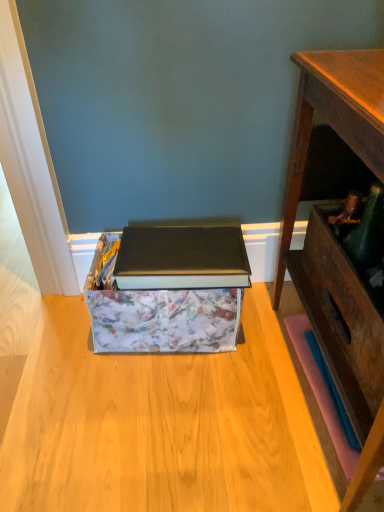
Question: Looking at the image, does floral-patterned cardboard box at center seem bigger or smaller compared to wooden desk at right?

Choices:
 (A) big
 (B) small

Answer: (B)

Question: In terms of width, does floral-patterned cardboard box at center look wider or thinner when compared to wooden desk at right?

Choices:
 (A) wide
 (B) thin

Answer: (B)

Question: In the image, is floral-patterned cardboard box at center positioned in front of or behind wooden desk at right?

Choices:
 (A) behind
 (B) front

Answer: (A)

Question: Considering the positions of wooden desk at right and floral-patterned cardboard box at center in the image, is wooden desk at right wider or thinner than floral-patterned cardboard box at center?

Choices:
 (A) thin
 (B) wide

Answer: (B)

Question: Based on their sizes in the image, would you say wooden desk at right is bigger or smaller than floral-patterned cardboard box at center?

Choices:
 (A) small
 (B) big

Answer: (B)

Question: From a real-world perspective, is wooden desk at right above or below floral-patterned cardboard box at center?

Choices:
 (A) below
 (B) above

Answer: (B)

Question: Would you say wooden desk at right is to the left or to the right of floral-patterned cardboard box at center in the picture?

Choices:
 (A) right
 (B) left

Answer: (A)